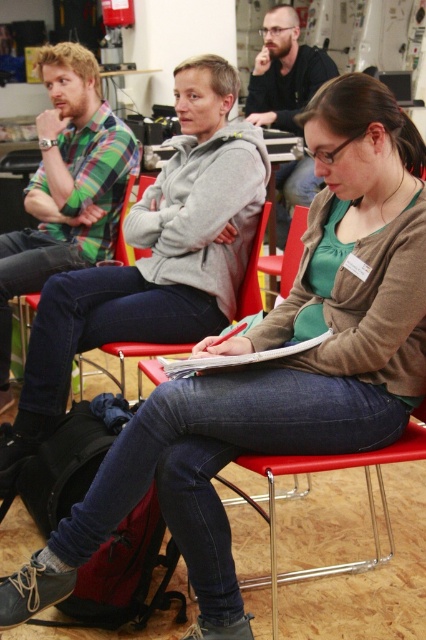
Does point (201, 205) come closer to viewer compared to point (287, 17)?

Yes, it is.

Who is lower down, matte gray hoodie at center or matte black shirt at center?

matte gray hoodie at center is lower down.

Does point (238, 122) lie behind point (275, 51)?

No, (238, 122) is in front of (275, 51).

This screenshot has width=426, height=640. Find the location of `matte gray hoodie at center`. matte gray hoodie at center is located at coordinates (155, 257).

Which is behind, point (239, 148) or point (8, 307)?

The point (8, 307) is more distant.

What do you see at coordinates (155, 257) in the screenshot?
I see `matte gray hoodie at center` at bounding box center [155, 257].

You are a GUI agent. You are given a task and a screenshot of the screen. Output one action in this format:
    pyautogui.click(x=<x>, y=<y>)
    Task: Click on the matte gray hoodie at center
    The height and width of the screenshot is (640, 426).
    Given the screenshot: What is the action you would take?
    pyautogui.click(x=155, y=257)

The image size is (426, 640). I want to click on matte gray hoodie at center, so click(x=155, y=257).

Between point (137, 147) and point (302, 83), which one is positioned in front?

Point (137, 147) is in front.

Between point (72, 230) and point (298, 196), which one is positioned behind?

Point (298, 196)

The width and height of the screenshot is (426, 640). In order to click on green plaid shirt at left in this screenshot , I will do `click(66, 186)`.